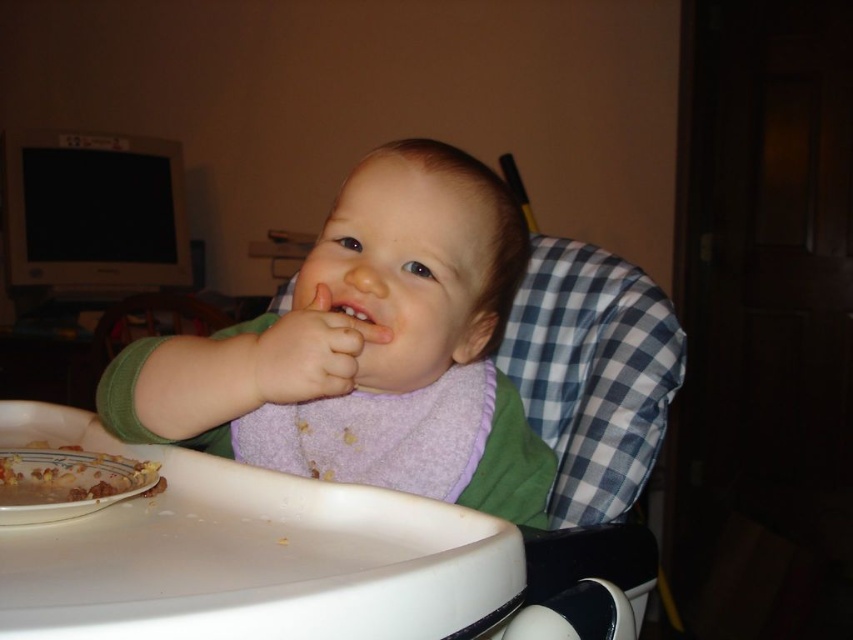
Question: Is blue checkered fabric at center wider than yellowish textured food at lower left?

Choices:
 (A) yes
 (B) no

Answer: (A)

Question: Does blue checkered fabric at center have a lesser width compared to yellowish textured food at lower left?

Choices:
 (A) yes
 (B) no

Answer: (B)

Question: Which point is closer to the camera?

Choices:
 (A) pink soft skin at center
 (B) yellowish textured food at lower left
 (C) purple fabric bib at center

Answer: (B)

Question: Does pink soft skin at center lie behind smooth skin mouth at center?

Choices:
 (A) yes
 (B) no

Answer: (B)

Question: Which object appears closest to the camera in this image?

Choices:
 (A) pink soft skin at center
 (B) yellowish textured food at lower left

Answer: (B)

Question: Which point is farther from the camera taking this photo?

Choices:
 (A) (271, 352)
 (B) (299, 384)
 (C) (570, 490)

Answer: (C)